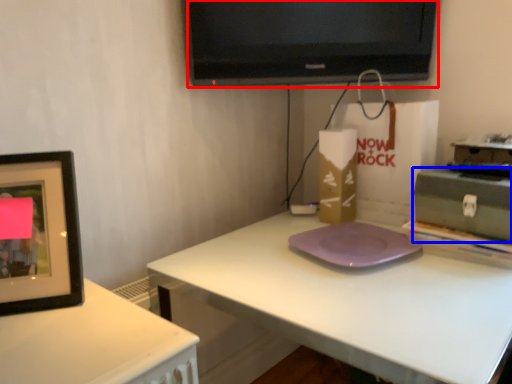
Question: Among these objects, which one is farthest to the camera, television (highlighted by a red box) or box (highlighted by a blue box)?

Choices:
 (A) television
 (B) box

Answer: (A)